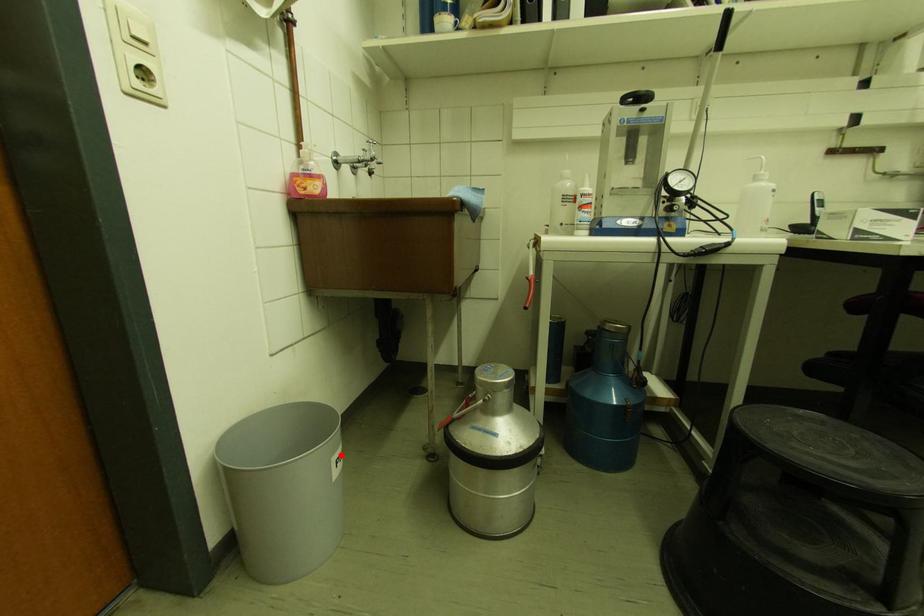
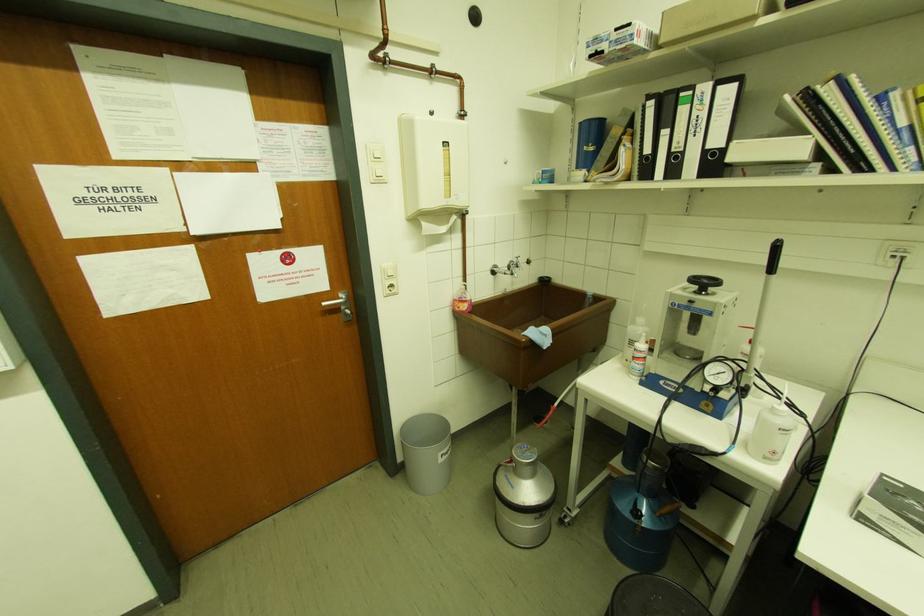
Question: I am providing you with two images of the same scene from different viewpoints. In image1, a red point is highlighted. Considering the same 3D point in image2, which of the following is correct?

Choices:
 (A) It is closer
 (B) It is farther

Answer: (A)